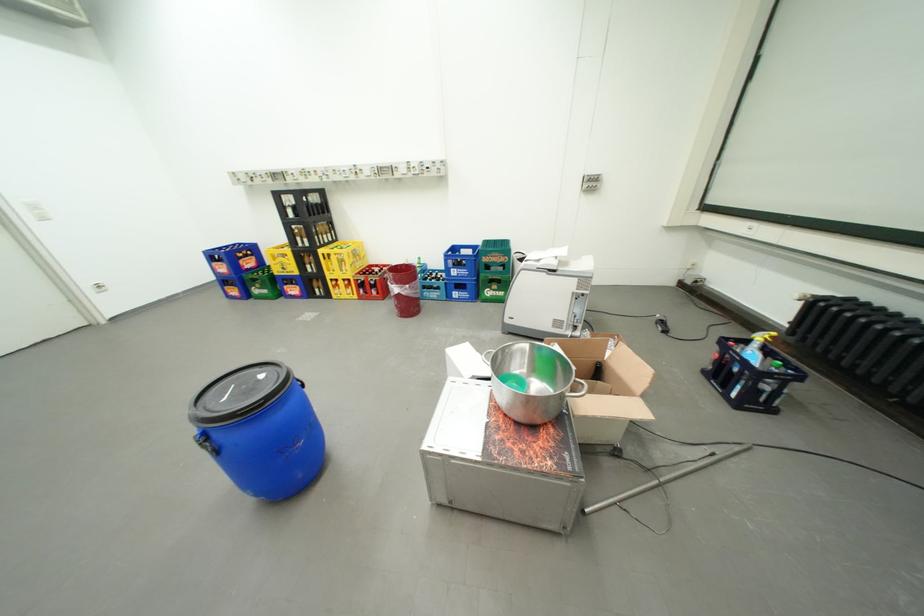
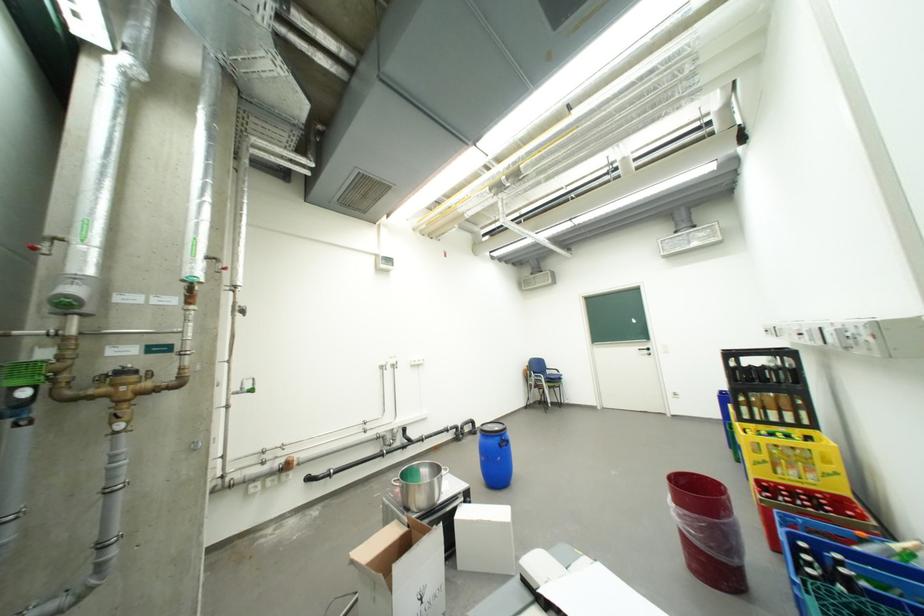
Find the pixel in the second image that matches point 418,286 in the first image.

(685, 507)